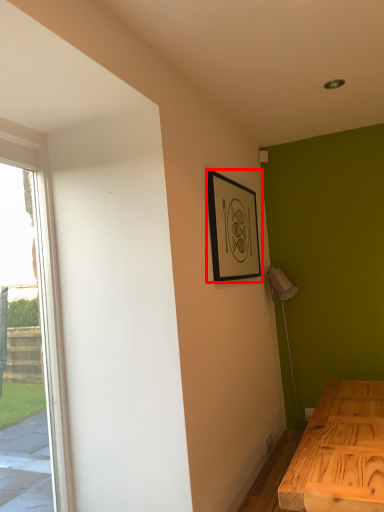
Question: From the image, what is the correct spatial relationship of picture frame (annotated by the red box) in relation to window?

Choices:
 (A) right
 (B) left

Answer: (A)